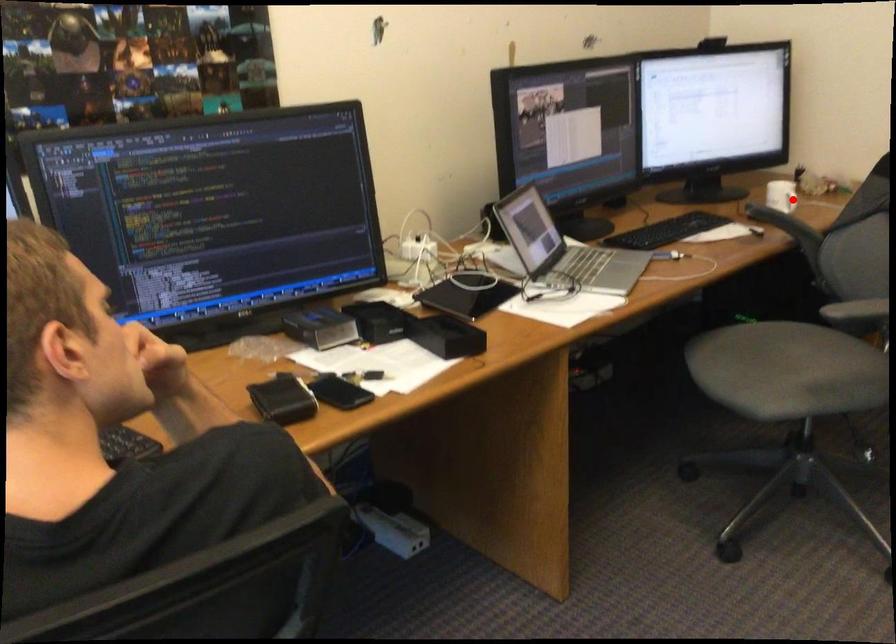
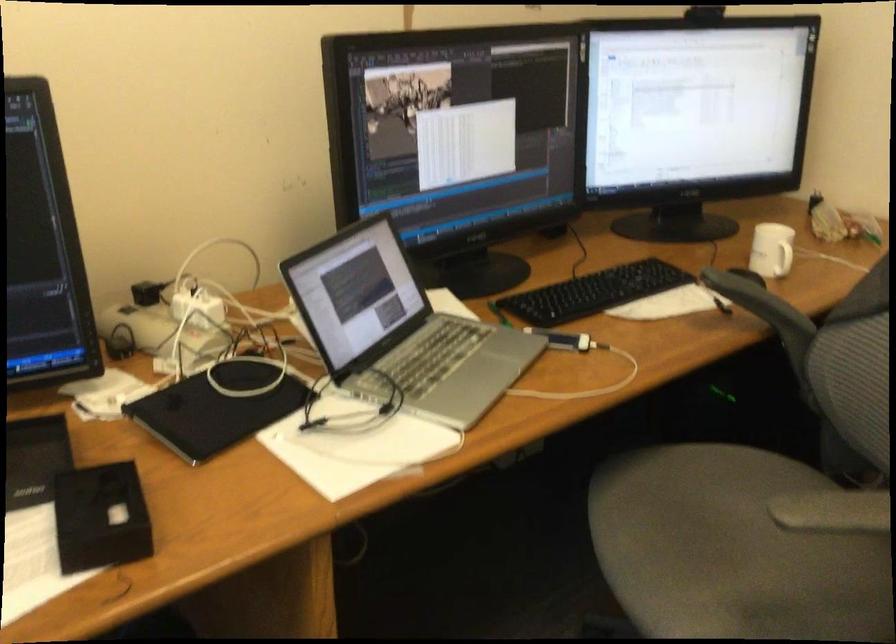
Question: A red point is marked in image1. In image2, is the corresponding 3D point closer to the camera or farther? Reply with the corresponding letter.

Choices:
 (A) The corresponding 3D point is closer.
 (B) The corresponding 3D point is farther.

Answer: (A)